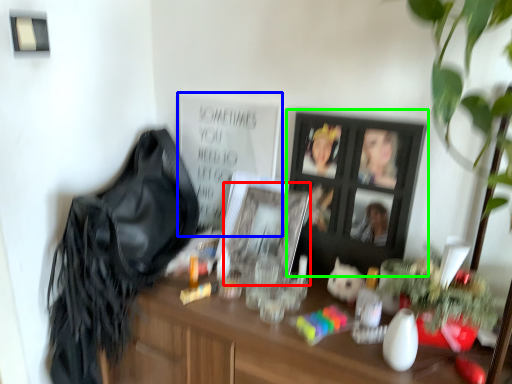
Question: Which is nearer to the picture frame (highlighted by a red box)? bulletin board (highlighted by a blue box) or picture frame (highlighted by a green box).

Choices:
 (A) bulletin board
 (B) picture frame

Answer: (B)